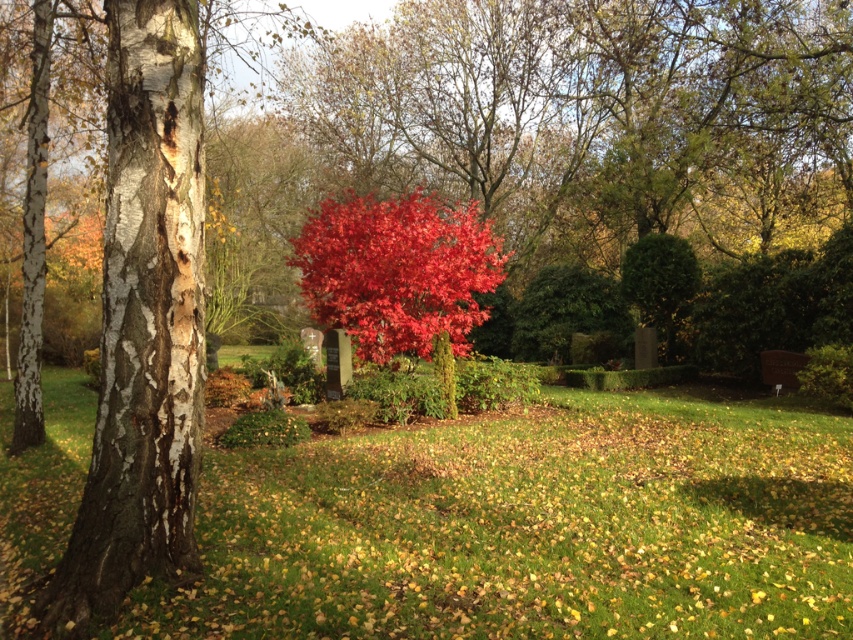
Question: Can you confirm if green grass at center is wider than white bark birch tree at left?

Choices:
 (A) no
 (B) yes

Answer: (B)

Question: Which of the following is the farthest from the observer?

Choices:
 (A) (583, 477)
 (B) (55, 572)
 (C) (425, 276)

Answer: (C)

Question: Which object is the closest to the green grass at center?

Choices:
 (A) shiny red maple at center
 (B) white bark birch tree at left

Answer: (B)

Question: Can you confirm if green grass at center is smaller than white bark birch tree at left?

Choices:
 (A) no
 (B) yes

Answer: (A)

Question: Is green grass at center positioned before shiny red maple at center?

Choices:
 (A) yes
 (B) no

Answer: (A)

Question: Among these points, which one is farthest from the camera?

Choices:
 (A) (378, 314)
 (B) (161, 13)

Answer: (A)